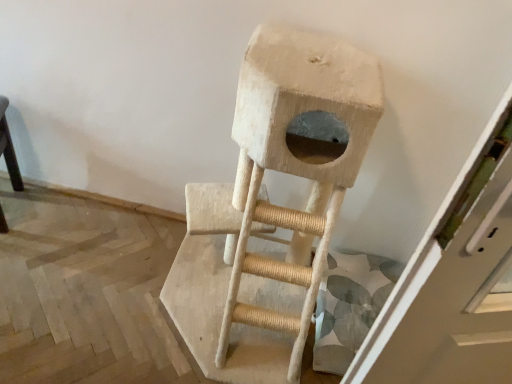
Question: Should I look upward or downward to see natural wood cat tree at center?

Choices:
 (A) up
 (B) down

Answer: (B)

Question: From the image's perspective, is smooth black table at left above natural wood cat tree at center?

Choices:
 (A) yes
 (B) no

Answer: (A)

Question: Is smooth black table at left further to camera compared to natural wood cat tree at center?

Choices:
 (A) no
 (B) yes

Answer: (B)

Question: Is smooth black table at left to the left of natural wood cat tree at center from the viewer's perspective?

Choices:
 (A) yes
 (B) no

Answer: (A)

Question: Can you confirm if smooth black table at left is positioned to the right of natural wood cat tree at center?

Choices:
 (A) no
 (B) yes

Answer: (A)

Question: From a real-world perspective, is smooth black table at left physically below natural wood cat tree at center?

Choices:
 (A) yes
 (B) no

Answer: (A)

Question: Is smooth black table at left wider than natural wood cat tree at center?

Choices:
 (A) yes
 (B) no

Answer: (B)

Question: Is natural wood cat tree at center behind smooth black table at left?

Choices:
 (A) no
 (B) yes

Answer: (A)

Question: Is natural wood cat tree at center to the right of smooth black table at left from the viewer's perspective?

Choices:
 (A) no
 (B) yes

Answer: (B)

Question: Would you say natural wood cat tree at center is outside smooth black table at left?

Choices:
 (A) yes
 (B) no

Answer: (A)

Question: Is smooth black table at left located within natural wood cat tree at center?

Choices:
 (A) yes
 (B) no

Answer: (B)

Question: Considering the relative positions of natural wood cat tree at center and smooth black table at left in the image provided, is natural wood cat tree at center to the left of smooth black table at left from the viewer's perspective?

Choices:
 (A) no
 (B) yes

Answer: (A)

Question: Is natural wood cat tree at center directly adjacent to smooth black table at left?

Choices:
 (A) no
 (B) yes

Answer: (A)

Question: Do you think natural wood cat tree at center is within smooth black table at left, or outside of it?

Choices:
 (A) outside
 (B) inside

Answer: (A)